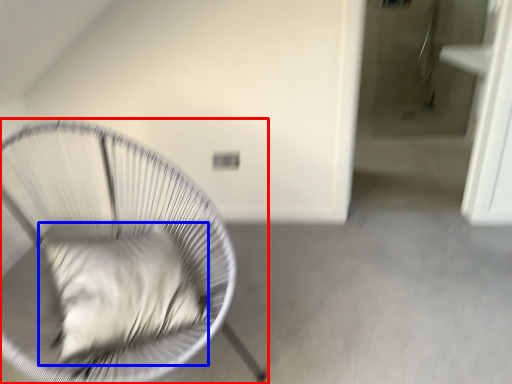
Question: Which of the following is the closest to the observer, furniture (highlighted by a red box) or pillow (highlighted by a blue box)?

Choices:
 (A) furniture
 (B) pillow

Answer: (A)